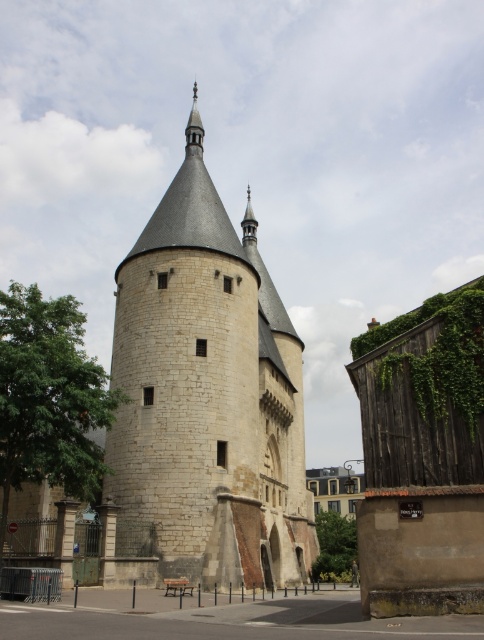
You are an architect designing a new garden layout around the stone tower at center and the green leafy ivy at right. Since you need to ensure the garden elements are proportionate to the structures, which of the two should you consider as the dominant feature in your design?

The stone tower at center should be the dominant feature in the garden design since it is larger in size than the green leafy ivy at right.

You are a city planner assessing the historical site. The stone tower at center is a protected monument. A new public garden is proposed to be built near the green leafy ivy at right. The garden will have a 20 meter safety zone around the tower. Will the proposed garden encroach into the safety zone?

The distance between the stone tower at center and the green leafy ivy at right is 24.62 meters, which is greater than the 20 meter safety zone. Therefore, the proposed garden will not encroach into the safety zone.

You are standing in front of the stone tower at center and want to take a photo of the green leafy ivy at right. In which direction should you move to get the ivy into your camera frame?

The stone tower at center is to the left of green leafy ivy at right, so you should move to the right side of the stone tower at center to capture the green leafy ivy at right in your photo.